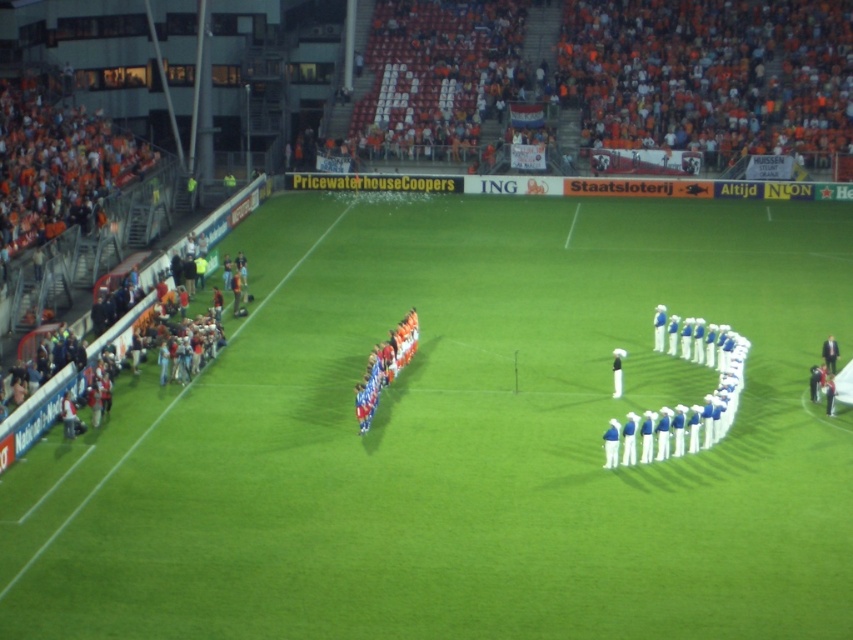
Find the location of `white cotton uniform at center`. white cotton uniform at center is located at coordinates (683, 404).

Is white cotton uniform at center thinner than blue uniformed people at center?

In fact, white cotton uniform at center might be wider than blue uniformed people at center.

Which is behind, point (700, 444) or point (412, 307)?

The point (412, 307) is behind.

Identify the location of white cotton uniform at center. The width and height of the screenshot is (853, 640). (683, 404).

Is blue uniformed people at center to the left of white fabric person at center from the viewer's perspective?

Indeed, blue uniformed people at center is positioned on the left side of white fabric person at center.

You are a GUI agent. You are given a task and a screenshot of the screen. Output one action in this format:
    pyautogui.click(x=<x>, y=<y>)
    Task: Click on the blue uniformed people at center
    The image size is (853, 640).
    Given the screenshot: What is the action you would take?
    pyautogui.click(x=384, y=368)

Between point (409, 340) and point (614, 387), which one is positioned behind?

Positioned behind is point (409, 340).

Locate an element on the screen. blue uniformed people at center is located at coordinates (384, 368).

The image size is (853, 640). Identify the location of green grass football field at center. (466, 440).

The width and height of the screenshot is (853, 640). Find the location of `green grass football field at center`. green grass football field at center is located at coordinates [x=466, y=440].